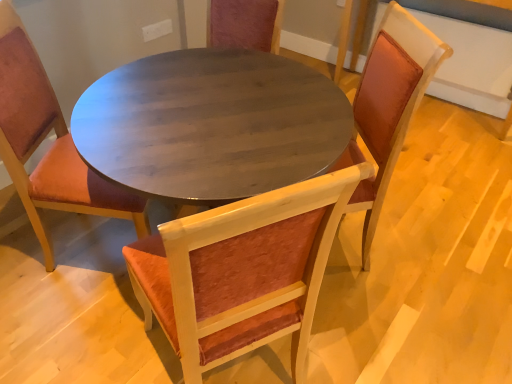
Question: Is velvet orange chair at center, which is the second chair from left to right, spatially inside velvet orange chair at center, which ranks as the first chair in right-to-left order, or outside of it?

Choices:
 (A) inside
 (B) outside

Answer: (B)

Question: From the image's perspective, relative to velvet orange chair at center, which ranks as the first chair in right-to-left order, is velvet orange chair at center, the 2th chair viewed from the right, above or below?

Choices:
 (A) below
 (B) above

Answer: (A)

Question: Estimate the real-world distances between objects in this image. Which object is farther from the velvet orange chair at center, the 2th chair viewed from the right?

Choices:
 (A) velvet orange chair at center, placed as the 3th chair when sorted from right to left
 (B) velvet orange chair at center, which is counted as the 3th chair, starting from the left

Answer: (B)

Question: Considering the real-world distances, which object is farthest from the velvet orange chair at center, which is counted as the 3th chair, starting from the left?

Choices:
 (A) velvet orange chair at center, placed as the 3th chair when sorted from right to left
 (B) velvet orange chair at center, which is the second chair from left to right

Answer: (A)